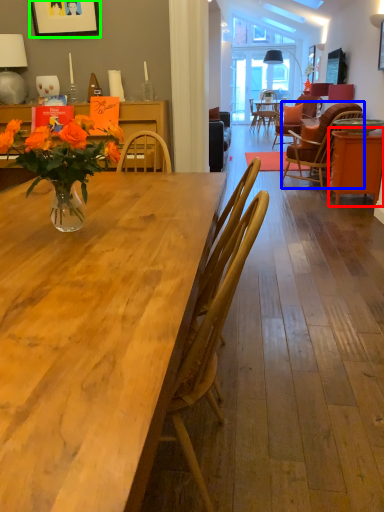
Question: Estimate the real-world distances between objects in this image. Which object is farther from table (highlighted by a red box), chair (highlighted by a blue box) or picture frame (highlighted by a green box)?

Choices:
 (A) chair
 (B) picture frame

Answer: (B)